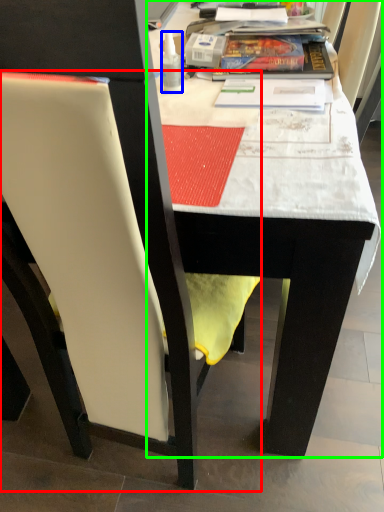
Question: Considering the real-world distances, which object is farthest from chair (highlighted by a red box)? bottle (highlighted by a blue box) or table (highlighted by a green box)?

Choices:
 (A) bottle
 (B) table

Answer: (A)